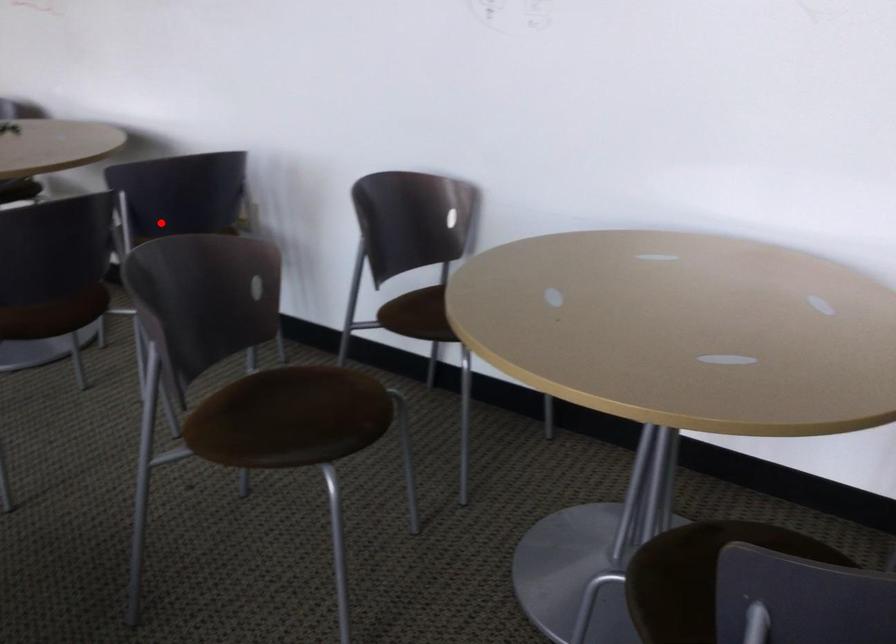
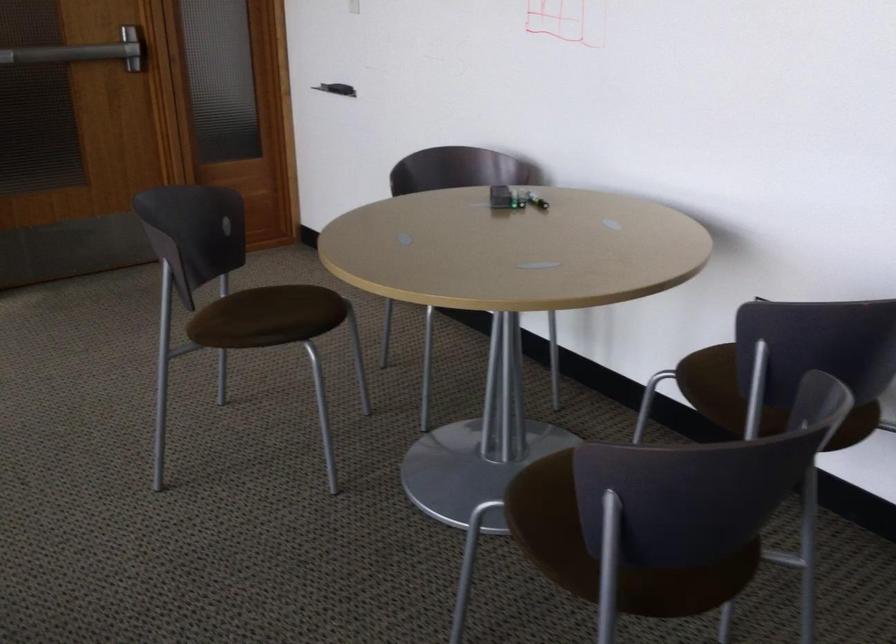
Question: I am providing you with two images of the same scene from different viewpoints. Image1 has a red point marked. In image2, the corresponding 3D location appears at what relative position? Reply with the corresponding letter.

Choices:
 (A) Closer
 (B) Farther

Answer: (A)